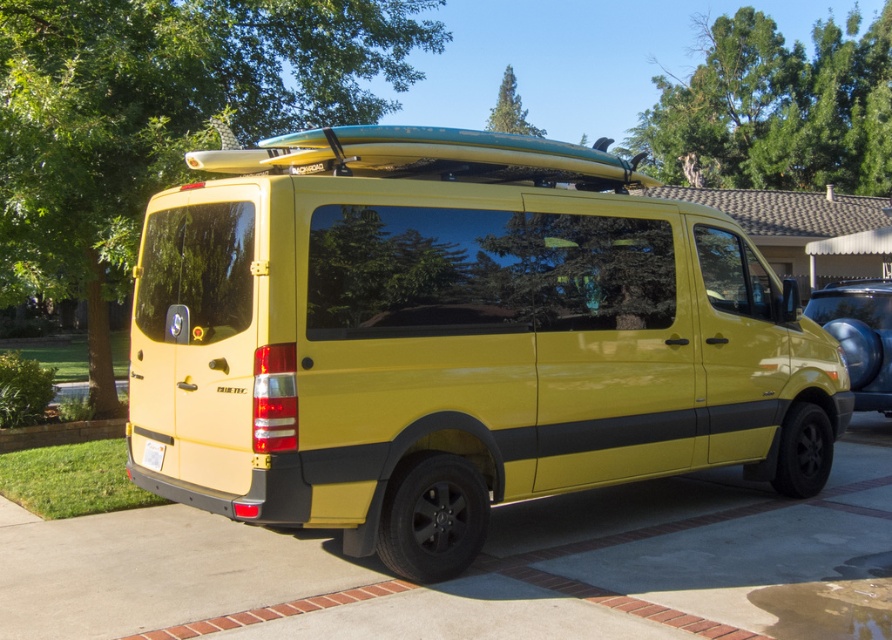
You are a delivery drone trying to land on the driveway near the metallic blue surfboard at right. The drone requires a 1 meter by 1 meter landing area. The driveway is 3 meters wide and 5 meters long. The surfboard is placed at coordinates 0.523, 0.964 in the image. Can you safely land the drone without hitting the surfboard?

The metallic blue surfboard at right is located at coordinates [859,333]. Since the driveway is 3 meters wide and 5 meters long, there is sufficient space to land the drone 1 meter by 1 meter away from the surfboard.

You are a delivery person trying to load a package onto the van. The package must be placed on the surfboard. However, the surfboard is currently occupied. Can you move the metallic blue surfboard at right to the left to make space? Explain why or why not based on its position relative to the white plastic license plate at lower center.

The metallic blue surfboard at right is positioned to the right of the white plastic license plate at lower center. Since the surfboard is already on the right side of the license plate, moving it further left might not be feasible as it could interfere with the van structure or other components near the license plate area. Therefore, it might not be possible to move it to the left to create space.

You are a delivery person who needs to park your vehicle in a parking spot that can only accommodate vehicles up to the size of the glossy yellow van at center. You have a truck that is the same size as the metallic blue surfboard at right. Can your truck fit in the parking spot?

The glossy yellow van at center has a smaller size compared to the metallic blue surfboard at right. Since the parking spot can only accommodate vehicles up to the size of the glossy yellow van at center, the truck, which is as large as the metallic blue surfboard at right, would be too big to fit in the parking spot.